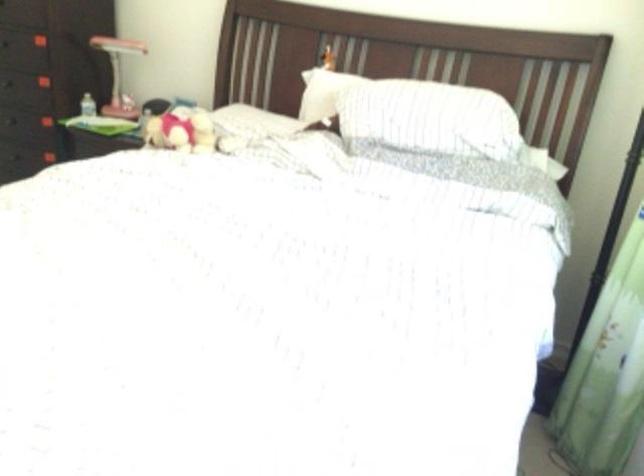
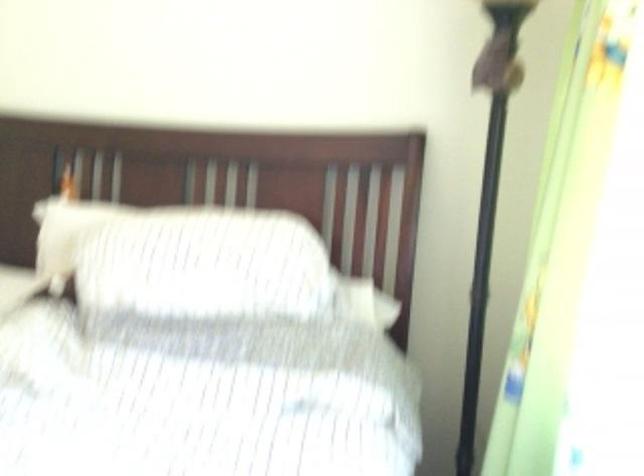
Question: The camera is either moving clockwise (left) or counter-clockwise (right) around the object. The first image is from the beginning of the video and the second image is from the end. Is the camera moving left or right when shooting the video?

Choices:
 (A) Left
 (B) Right

Answer: (A)